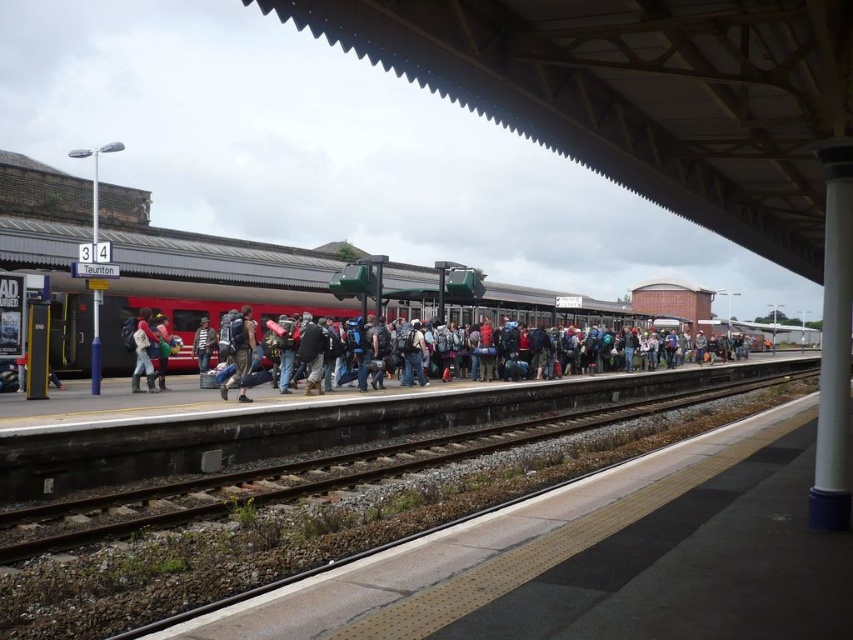
Is matte black backpacks at center taller than striped sweater at center?

No, matte black backpacks at center is not taller than striped sweater at center.

Who is more distant from viewer, [276,336] or [198,333]?

The point [198,333] is behind.

Locate an element on the screen. matte black backpacks at center is located at coordinates (244, 371).

I want to click on matte black backpack at center, so click(x=143, y=352).

Is matte black backpack at center behind striped sweater at center?

No, it is in front of striped sweater at center.

Which is behind, point (151, 339) or point (206, 323)?

The point (206, 323) is more distant.

Locate an element on the screen. The image size is (853, 640). matte black backpack at center is located at coordinates (143, 352).

Between matte black backpacks at center and matte black backpack at center, which one appears on the left side from the viewer's perspective?

matte black backpack at center

Which is in front, point (247, 378) or point (143, 333)?

Positioned in front is point (247, 378).

Which is in front, point (247, 376) or point (138, 317)?

Point (247, 376) is in front.

Where is `matte black backpacks at center`? The image size is (853, 640). matte black backpacks at center is located at coordinates (244, 371).